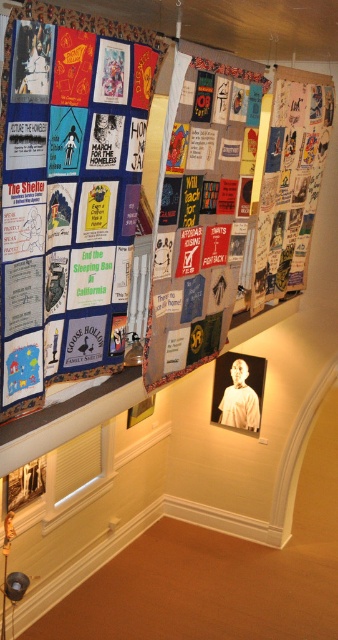
You are an artist planning to hang a new poster on the display structure. The gallery requires that all new additions must be placed at least 0.1 units away from any existing artwork. Given the coordinates of the textile collage at upper center, what is the minimum distance you need to maintain from its position?

The textile collage at upper center is located at point [199,212]. To comply with the gallery requirements, you must keep at least 0.1 units away from this position.

What is located at the coordinates point (68, 195) in the image?

The point (68, 195) marks the location of the textile collage at upper left.